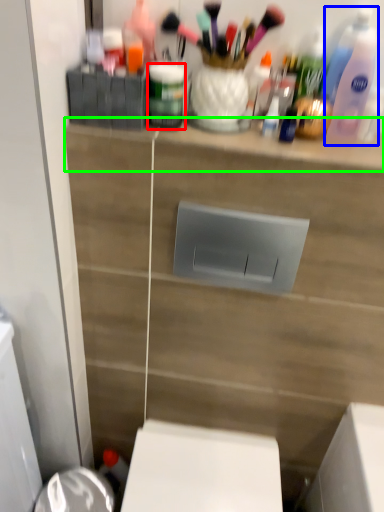
Question: Considering the real-world distances, which object is closest to toiletry (highlighted by a red box)? cleaning product (highlighted by a blue box) or ledge (highlighted by a green box).

Choices:
 (A) cleaning product
 (B) ledge

Answer: (B)